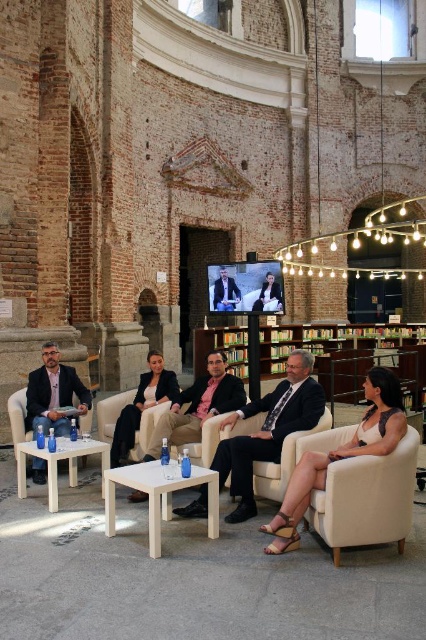
Does matte black suit at left lie behind beige fabric armchair at center?

No, matte black suit at left is closer to the viewer.

In the scene shown: Does matte black suit at left have a larger size compared to beige fabric armchair at center?

Correct, matte black suit at left is larger in size than beige fabric armchair at center.

Where is `matte black suit at left`? matte black suit at left is located at coordinates (54, 394).

At what (x,y) coordinates should I click in order to perform the action: click on wooden bookshelf at center. Please return your answer as a coordinate pair (x, y). Image resolution: width=426 pixels, height=640 pixels. Looking at the image, I should click on (322, 355).

Between point (256, 369) and point (376, 426), which one is positioned in front?

Point (376, 426)

This screenshot has width=426, height=640. Describe the element at coordinates (322, 355) in the screenshot. I see `wooden bookshelf at center` at that location.

You are a GUI agent. You are given a task and a screenshot of the screen. Output one action in this format:
    pyautogui.click(x=<x>, y=<y>)
    Task: Click on the wooden bookshelf at center
    
    Given the screenshot: What is the action you would take?
    pyautogui.click(x=322, y=355)

Is beige fabric armchair at center positioned before smooth leather jacket at center?

Yes, beige fabric armchair at center is in front of smooth leather jacket at center.

Is beige fabric armchair at center shorter than smooth leather jacket at center?

Correct, beige fabric armchair at center is not as tall as smooth leather jacket at center.

Describe the element at coordinates (112, 412) in the screenshot. I see `beige fabric armchair at center` at that location.

The height and width of the screenshot is (640, 426). Find the location of `beige fabric armchair at center`. beige fabric armchair at center is located at coordinates (112, 412).